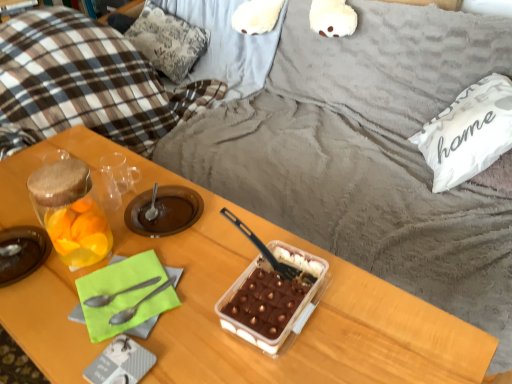
Question: Are metallic silver spoon at lower left, acting as the first spoon starting from the left, and translucent glass jar at left located far from each other?

Choices:
 (A) yes
 (B) no

Answer: (B)

Question: Can you confirm if metallic silver spoon at lower left, acting as the first spoon starting from the left, is wider than translucent glass jar at left?

Choices:
 (A) no
 (B) yes

Answer: (A)

Question: Is the surface of metallic silver spoon at lower left, the 3th spoon from the right, in direct contact with translucent glass jar at left?

Choices:
 (A) no
 (B) yes

Answer: (A)

Question: Considering the relative sizes of metallic silver spoon at lower left, acting as the first spoon starting from the left, and translucent glass jar at left in the image provided, is metallic silver spoon at lower left, acting as the first spoon starting from the left, thinner than translucent glass jar at left?

Choices:
 (A) no
 (B) yes

Answer: (B)

Question: Considering the relative sizes of metallic silver spoon at lower left, the 3th spoon from the right, and translucent glass jar at left in the image provided, is metallic silver spoon at lower left, the 3th spoon from the right, shorter than translucent glass jar at left?

Choices:
 (A) no
 (B) yes

Answer: (A)

Question: Considering the relative positions of metallic silver spoon at lower left, acting as the first spoon starting from the left, and translucent glass jar at left in the image provided, is metallic silver spoon at lower left, acting as the first spoon starting from the left, behind translucent glass jar at left?

Choices:
 (A) no
 (B) yes

Answer: (A)

Question: Considering the relative positions of translucent glass jar at left and wooden table at center in the image provided, is translucent glass jar at left to the right of wooden table at center from the viewer's perspective?

Choices:
 (A) no
 (B) yes

Answer: (A)

Question: Is translucent glass jar at left positioned with its back to wooden table at center?

Choices:
 (A) yes
 (B) no

Answer: (B)

Question: Is translucent glass jar at left thinner than wooden table at center?

Choices:
 (A) yes
 (B) no

Answer: (A)

Question: Does translucent glass jar at left have a smaller size compared to wooden table at center?

Choices:
 (A) no
 (B) yes

Answer: (B)

Question: From the image's perspective, would you say translucent glass jar at left is shown under wooden table at center?

Choices:
 (A) no
 (B) yes

Answer: (A)

Question: Considering the relative sizes of translucent glass jar at left and wooden table at center in the image provided, is translucent glass jar at left wider than wooden table at center?

Choices:
 (A) no
 (B) yes

Answer: (A)

Question: Does black plastic spoon at center, the third spoon from the left, appear on the left side of translucent plastic tray at center, the 2th snack positioned from the left?

Choices:
 (A) yes
 (B) no

Answer: (A)